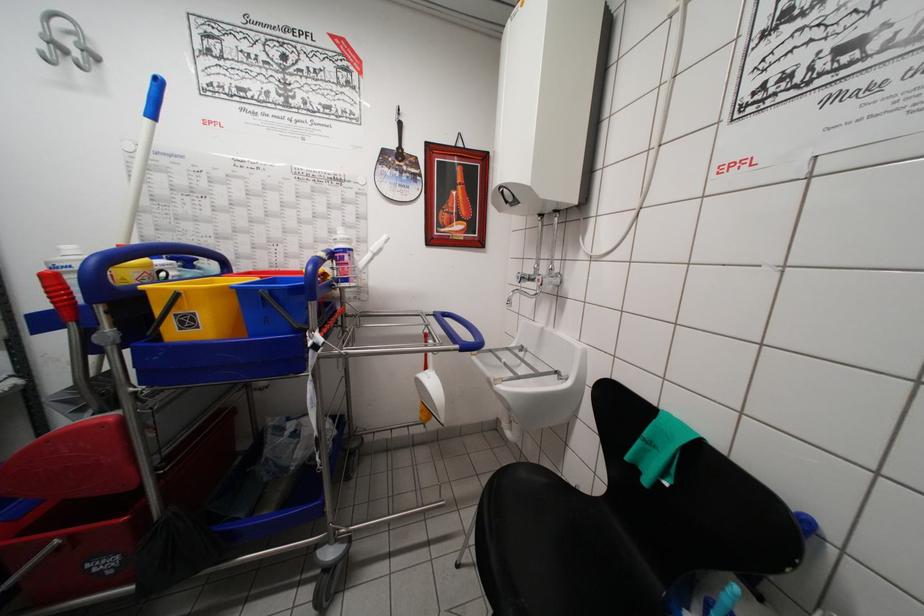
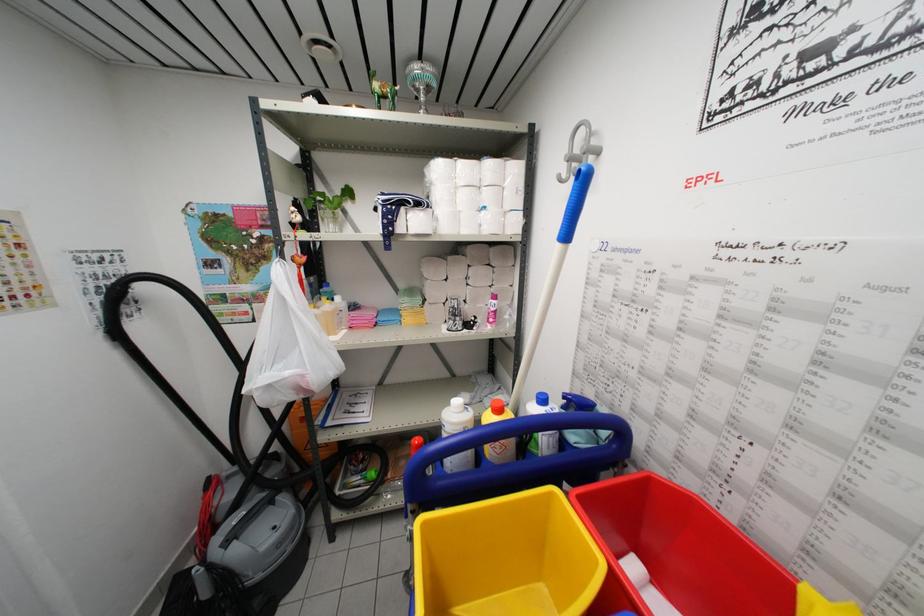
Question: The first image is from the beginning of the video and the second image is from the end. How did the camera likely rotate when shooting the video?

Choices:
 (A) Left
 (B) Right
 (C) Up
 (D) Down

Answer: (A)